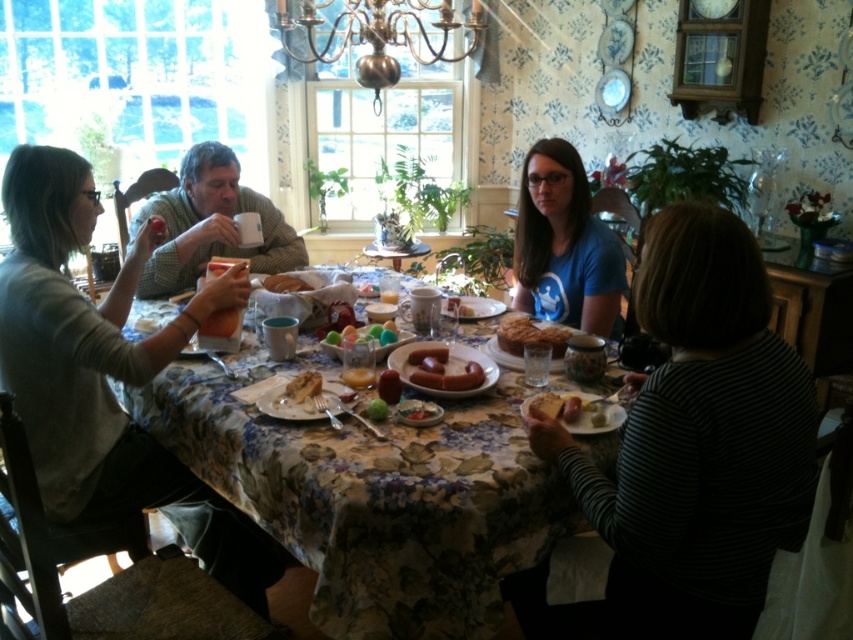
You are a guest at the table and want to reach for the golden brown bread at center and the green matte apple at center. Which one is closer to your right hand if you are sitting at the table?

The golden brown bread at center is closer to your right hand because it is positioned to the right of the green matte apple at center.

You are a chef preparing to place a 10.5 inch wide plate between the golden brown bread at center and the green matte apple at center. Can the plate fit between them without overlapping either object?

The golden brown bread at center and green matte apple at center are 20.20 inches apart. Since the plate is 10.5 inches wide, there is sufficient space between them to place the plate without overlapping either object.

You are a guest at the table and want to reach for the slightly browned sausage at center. However, there is a matte ceramic plate at center in the way. Can you easily access the sausage without moving the plate?

The slightly browned sausage at center is positioned under the matte ceramic plate at center, so you would need to move the plate to access the sausage.